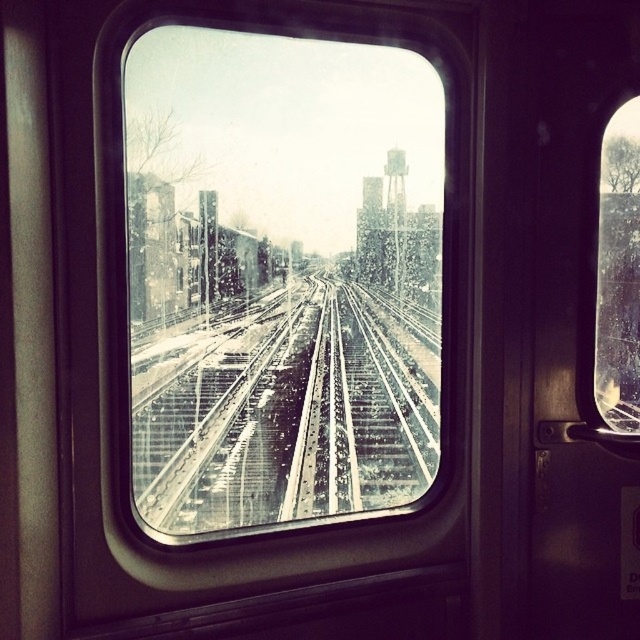
You are inside the train and want to know how far the point at coordinates (412, 492) is from your current position. Can you determine the distance?

The point at coordinates (412, 492) is 2.04 meters away from the camera, so the distance from your current position inside the train to that point is approximately 2.04 meters.

You are inside a train and looking through the window. There is a point at coordinate (282, 276). What object is located at that point?

The point at coordinate (282, 276) indicates the metallic glass train window at center.